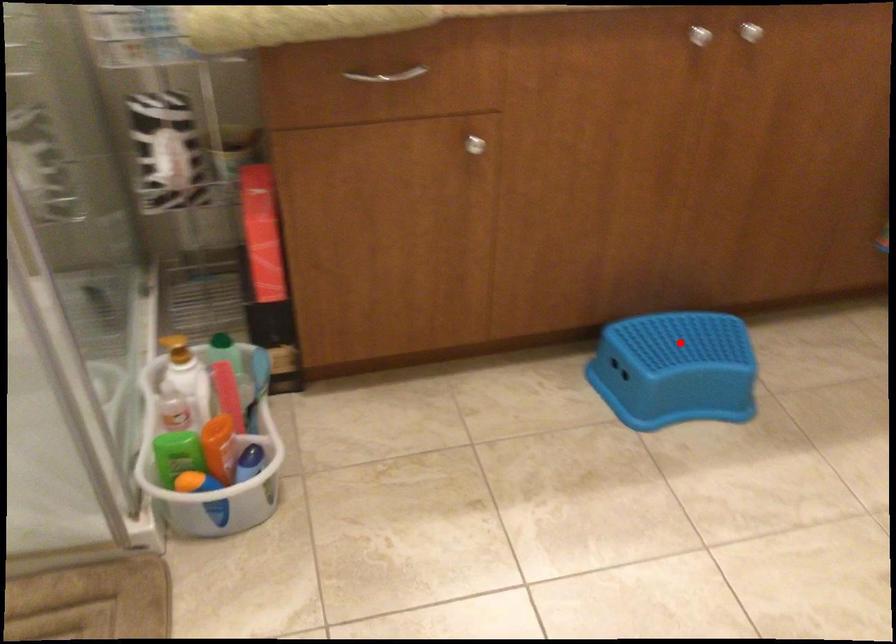
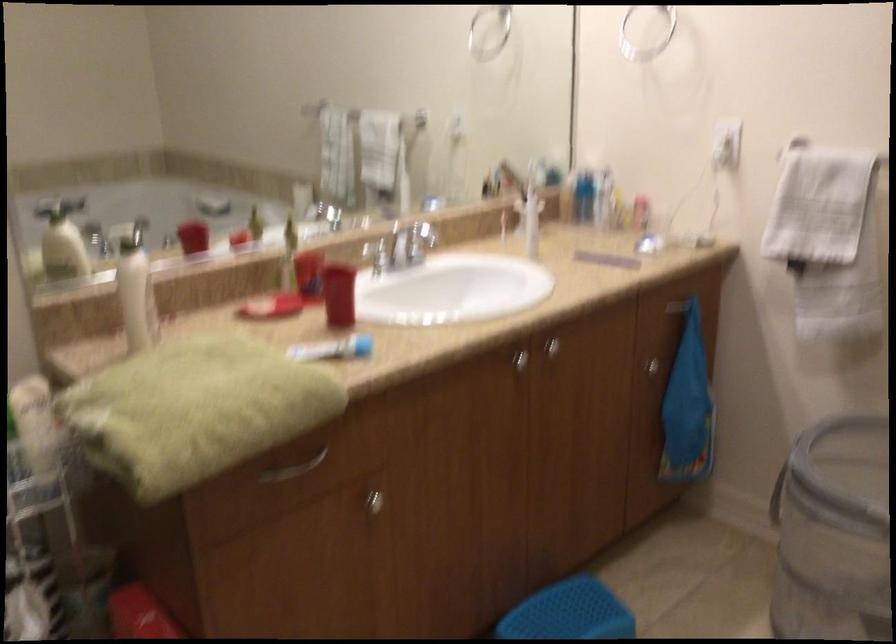
The point at the highlighted location is marked in the first image. Where is the corresponding point in the second image?

(569, 612)